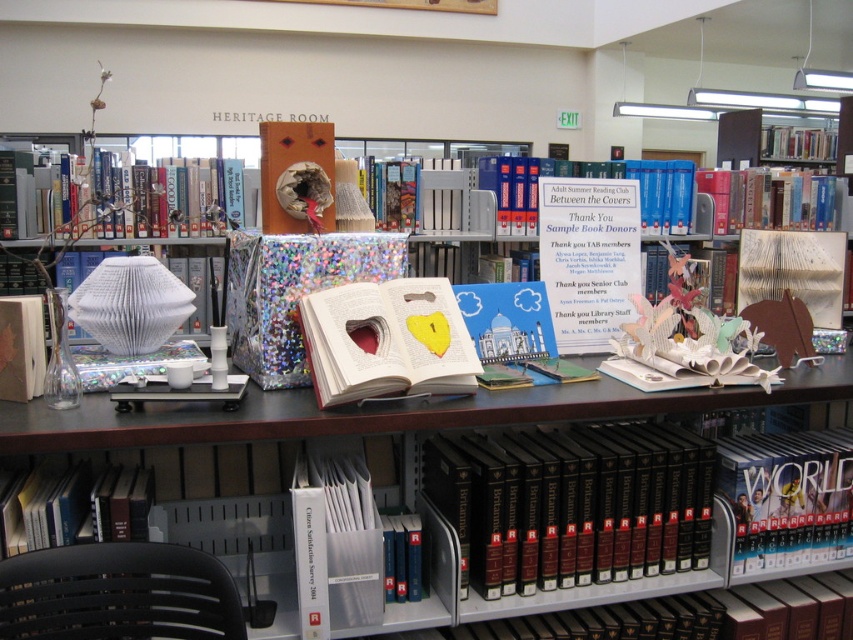
Is point (821, 493) less distant than point (758, 204)?

Yes, it is.

The height and width of the screenshot is (640, 853). Describe the element at coordinates (787, 497) in the screenshot. I see `hardcover book at lower right` at that location.

I want to click on hardcover book at lower right, so click(787, 497).

Is blue hardcover book at center above hardcover book at upper right?

Correct, blue hardcover book at center is located above hardcover book at upper right.

Which is more to the right, blue hardcover book at center or hardcover book at upper right?

From the viewer's perspective, hardcover book at upper right appears more on the right side.

The height and width of the screenshot is (640, 853). Describe the element at coordinates (601, 177) in the screenshot. I see `blue hardcover book at center` at that location.

Identify the location of blue hardcover book at center. (601, 177).

Is matte paper book at center taller than blue hardcover book at center?

In fact, matte paper book at center may be shorter than blue hardcover book at center.

Between point (354, 380) and point (651, 196), which one is positioned behind?

Positioned behind is point (651, 196).

Where is `matte paper book at center`? The image size is (853, 640). matte paper book at center is located at coordinates (387, 340).